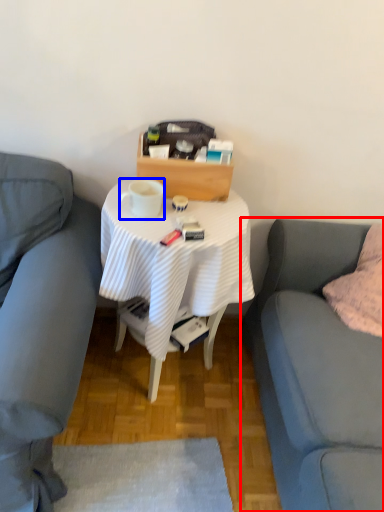
Question: Among these objects, which one is farthest to the camera, studio couch (highlighted by a red box) or coffee cup (highlighted by a blue box)?

Choices:
 (A) studio couch
 (B) coffee cup

Answer: (B)